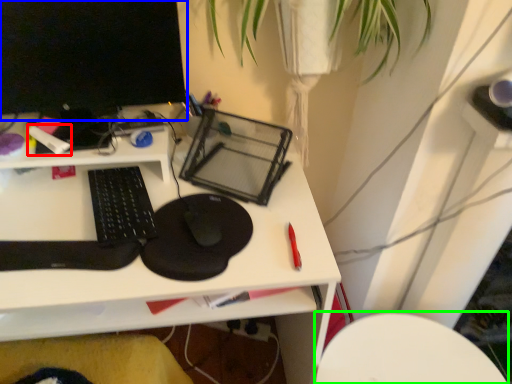
Question: Which is nearer to the stationery (highlighted by a red box)? computer monitor (highlighted by a blue box) or computer chair (highlighted by a green box).

Choices:
 (A) computer monitor
 (B) computer chair

Answer: (A)